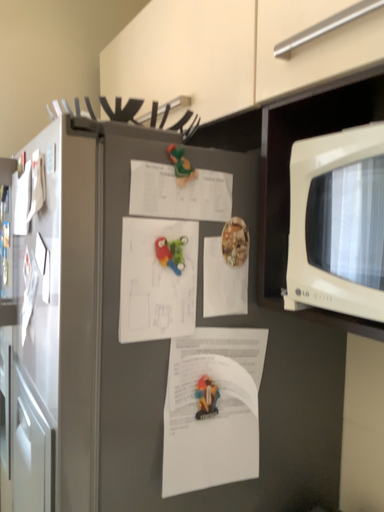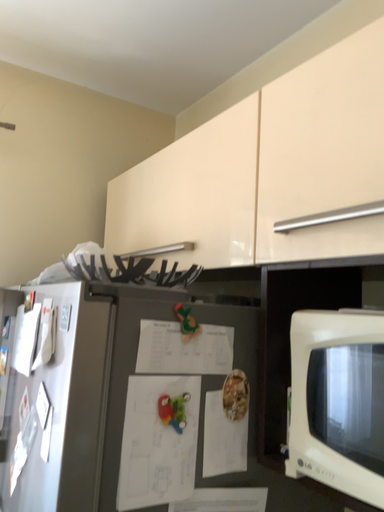
Question: Which way did the camera rotate in the video?

Choices:
 (A) rotated upward
 (B) rotated downward

Answer: (A)